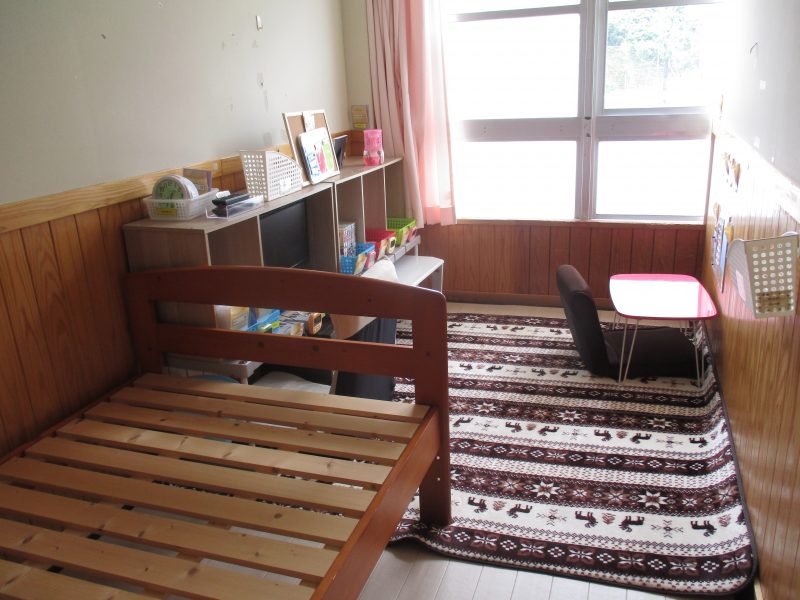
What are the coordinates of `pink curtain` in the screenshot? It's located at (410, 68).